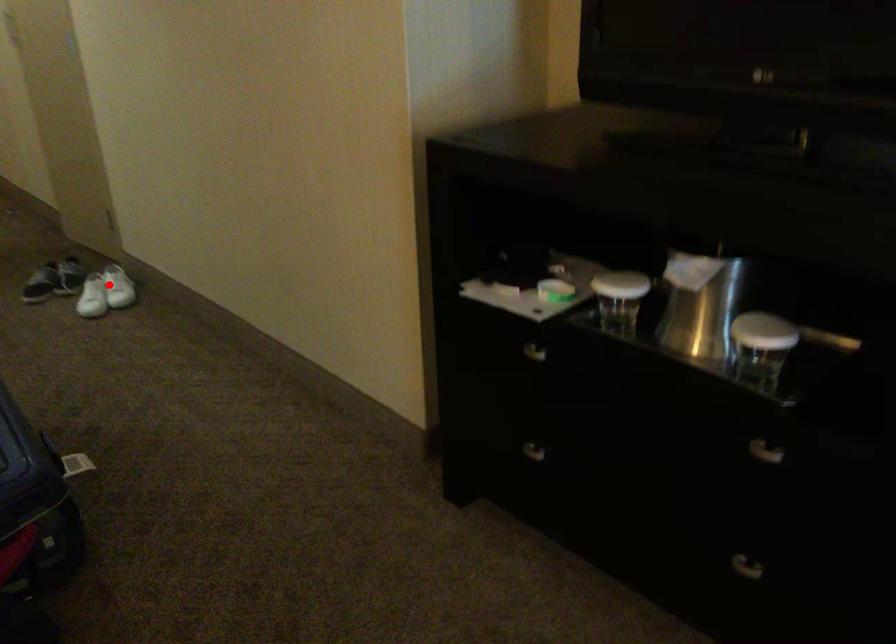
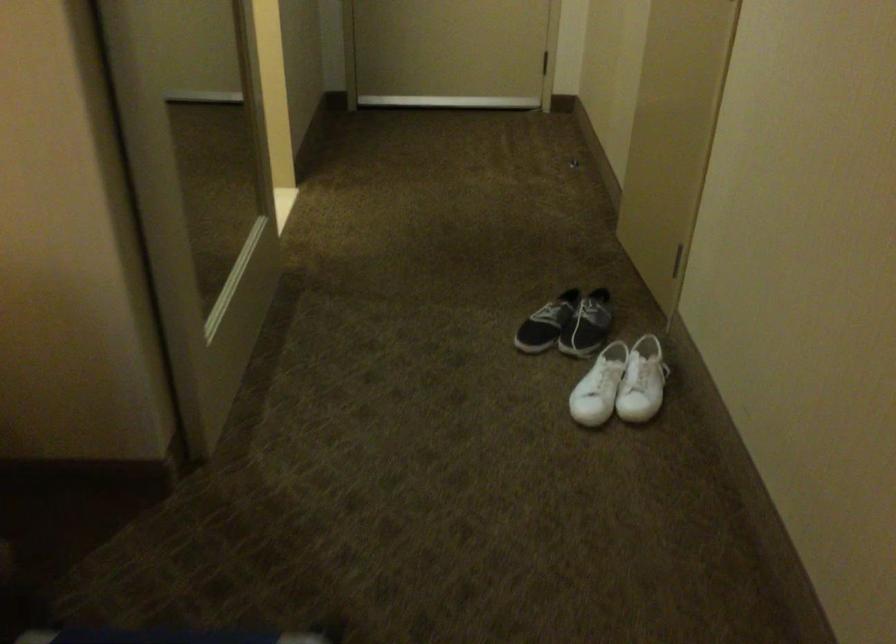
The point at the highlighted location is marked in the first image. Where is the corresponding point in the second image?

(642, 382)